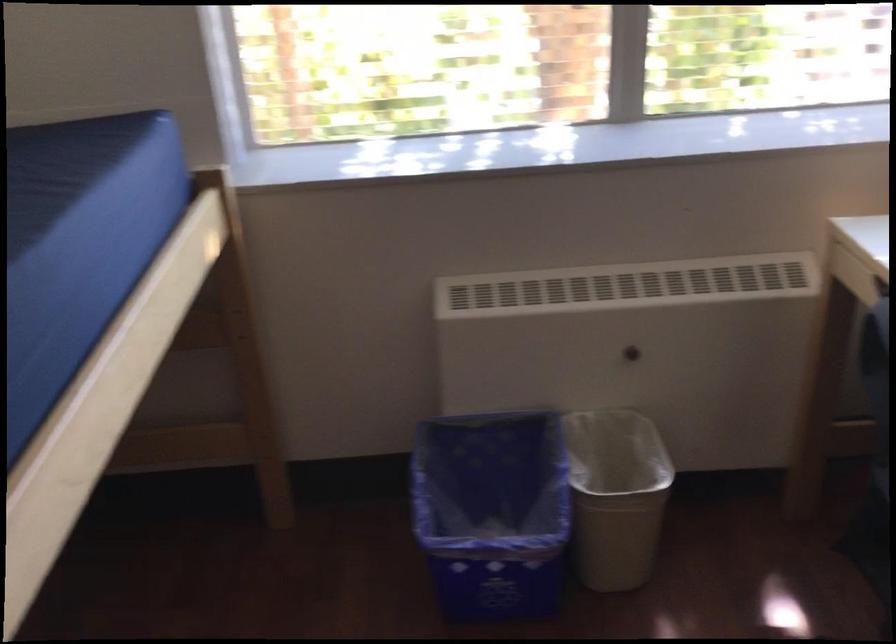
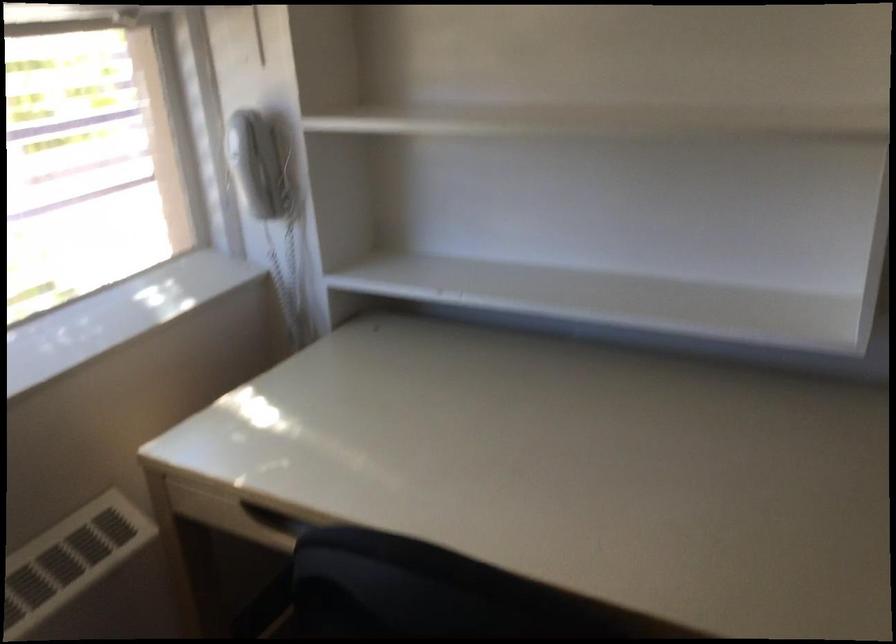
Question: The images are taken continuously from a first-person perspective. In which direction is your viewpoint rotating?

Choices:
 (A) Left
 (B) Right
 (C) Up
 (D) Down

Answer: (B)